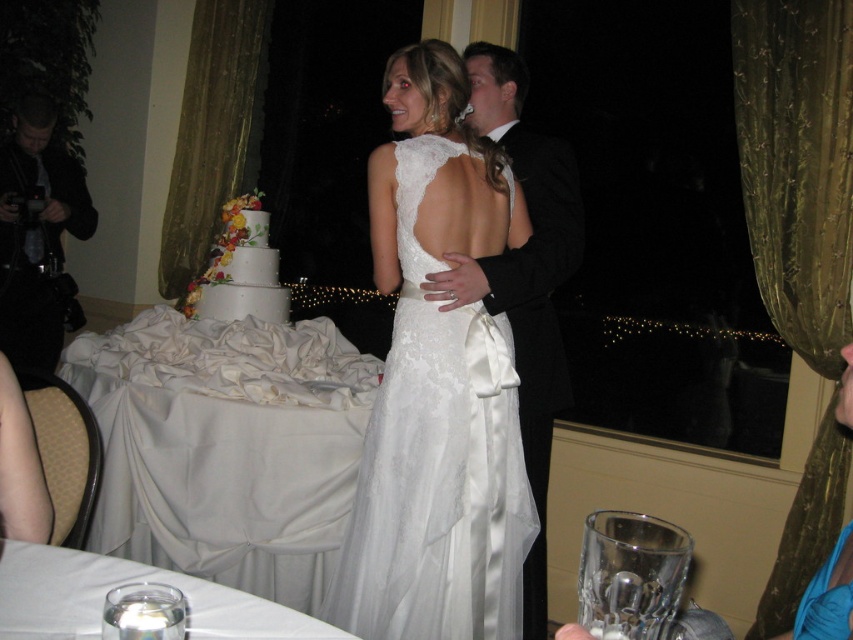
You are a photographer at the wedding and want to ensure both the lace fabric dress at center and the white textured cake at left are clearly visible in your photo. Given their sizes, which object should you focus on first to ensure proper framing?

The lace fabric dress at center is larger in size than the white textured cake at left, so you should focus on the lace fabric dress at center first to ensure it fits within the frame properly before adjusting for the smaller cake.

You are a photographer at the wedding and want to capture a photo of the lace fabric dress at center and the black satin tuxedo at right. Since the lighting is low, you need to ensure both subjects are fully visible. Which subject should you focus on first to ensure proper exposure?

The lace fabric dress at center is in front of the black satin tuxedo at right, so you should focus on the lace fabric dress at center first to ensure proper exposure.